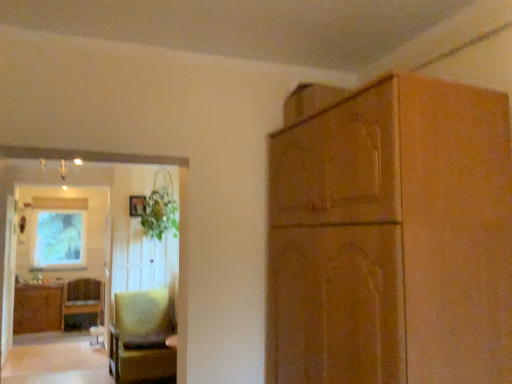
At what (x,y) coordinates should I click in order to perform the action: click on matte green painting at upper left. Please return your answer as a coordinate pair (x, y). Looking at the image, I should click on (58, 233).

Where is `velvet yellow chair at lower left, marked as the second chair in a left-to-right arrangement`? velvet yellow chair at lower left, marked as the second chair in a left-to-right arrangement is located at coordinates (142, 338).

Describe the element at coordinates (392, 239) in the screenshot. The width and height of the screenshot is (512, 384). I see `wooden cabinet at upper right, acting as the first cabinetry starting from the front` at that location.

This screenshot has height=384, width=512. I want to click on wooden chair at lower left, placed as the second chair when sorted from front to back, so click(83, 298).

Is wooden cabinet at upper right, placed as the second cabinetry when sorted from back to front, beside wooden chair at lower left, the first chair when ordered from left to right?

No, wooden cabinet at upper right, placed as the second cabinetry when sorted from back to front, is not with wooden chair at lower left, the first chair when ordered from left to right.

Is wooden cabinet at upper right, positioned as the 1th cabinetry in right-to-left order, to the right of wooden chair at lower left, placed as the second chair when sorted from front to back, from the viewer's perspective?

Correct, you'll find wooden cabinet at upper right, positioned as the 1th cabinetry in right-to-left order, to the right of wooden chair at lower left, placed as the second chair when sorted from front to back.

Between wooden cabinet at upper right, positioned as the 1th cabinetry in right-to-left order, and wooden chair at lower left, placed as the first chair when sorted from back to front, which one has less height?

wooden chair at lower left, placed as the first chair when sorted from back to front, is shorter.

What's the angular difference between green leafy plant at upper left and matte green painting at upper left's facing directions?

The angle between the facing direction of green leafy plant at upper left and the facing direction of matte green painting at upper left is 0.799 degrees.

Find the location of a particular element. The width and height of the screenshot is (512, 384). plant located in front of the matte green painting at upper left is located at coordinates (161, 208).

Based on the photo, is green leafy plant at upper left far away from matte green painting at upper left?

Yes, green leafy plant at upper left is far from matte green painting at upper left.

Is green leafy plant at upper left facing away from matte green painting at upper left?

No, green leafy plant at upper left's orientation is not away from matte green painting at upper left.

I want to click on plant lying behind the velvet yellow chair at lower left, which is the 1th chair from right to left, so click(x=161, y=208).

Which is behind, point (169, 325) or point (154, 217)?

The point (154, 217) is farther.

From a real-world perspective, which object stands above the other?

From a 3D spatial view, green leafy plant at upper left is above.

Between velvet yellow chair at lower left, which appears as the second chair when viewed from the back, and green leafy plant at upper left, which one has smaller size?

With smaller size is green leafy plant at upper left.

Considering the sizes of objects woven wicker cabinet at lower left, the 1th cabinetry from the left, and wooden cabinet at upper right, acting as the first cabinetry starting from the front, in the image provided, who is bigger, woven wicker cabinet at lower left, the 1th cabinetry from the left, or wooden cabinet at upper right, acting as the first cabinetry starting from the front,?

Bigger between the two is wooden cabinet at upper right, acting as the first cabinetry starting from the front.

From a real-world perspective, which object stands above the other?

wooden cabinet at upper right, which is the 2th cabinetry in bottom-to-top order, from a real-world perspective.

Considering the positions of points (57, 293) and (486, 308), is point (57, 293) closer to camera compared to point (486, 308)?

No, (57, 293) is behind (486, 308).

Between woven wicker cabinet at lower left, arranged as the first cabinetry when ordered from the bottom, and wooden cabinet at upper right, which is the 2th cabinetry in bottom-to-top order, which one has larger width?

With larger width is wooden cabinet at upper right, which is the 2th cabinetry in bottom-to-top order.

Is wooden chair at lower left, the second chair viewed from the right, at the back of velvet yellow chair at lower left, which is the 1th chair from right to left?

Correct, velvet yellow chair at lower left, which is the 1th chair from right to left, is looking away from wooden chair at lower left, the second chair viewed from the right.

Considering the relative sizes of velvet yellow chair at lower left, acting as the first chair starting from the front, and wooden chair at lower left, the second chair viewed from the right, in the image provided, is velvet yellow chair at lower left, acting as the first chair starting from the front, bigger than wooden chair at lower left, the second chair viewed from the right,?

Correct, velvet yellow chair at lower left, acting as the first chair starting from the front, is larger in size than wooden chair at lower left, the second chair viewed from the right.

From a real-world perspective, is velvet yellow chair at lower left, which appears as the second chair when viewed from the back, located beneath wooden chair at lower left, placed as the first chair when sorted from back to front?

Actually, velvet yellow chair at lower left, which appears as the second chair when viewed from the back, is physically above wooden chair at lower left, placed as the first chair when sorted from back to front, in the real world.

From a real-world perspective, which object stands above the other?

green leafy plant at upper left is physically above.

Is green leafy plant at upper left oriented away from wooden cabinet at upper right, positioned as the 1th cabinetry in right-to-left order?

No, wooden cabinet at upper right, positioned as the 1th cabinetry in right-to-left order, is not at the back of green leafy plant at upper left.

Is green leafy plant at upper left shorter than wooden cabinet at upper right, which is the first cabinetry in top-to-bottom order?

Yes, green leafy plant at upper left is shorter than wooden cabinet at upper right, which is the first cabinetry in top-to-bottom order.

Can you confirm if green leafy plant at upper left is smaller than wooden cabinet at upper right, which is the first cabinetry in top-to-bottom order?

Indeed, green leafy plant at upper left has a smaller size compared to wooden cabinet at upper right, which is the first cabinetry in top-to-bottom order.

From the image's perspective, is velvet yellow chair at lower left, which appears as the second chair when viewed from the back, below woven wicker cabinet at lower left, arranged as the first cabinetry when ordered from the bottom?

Actually, velvet yellow chair at lower left, which appears as the second chair when viewed from the back, appears above woven wicker cabinet at lower left, arranged as the first cabinetry when ordered from the bottom, in the image.

Is woven wicker cabinet at lower left, which appears as the 1th cabinetry when viewed from the back, a part of velvet yellow chair at lower left, marked as the second chair in a left-to-right arrangement?

Definitely not — woven wicker cabinet at lower left, which appears as the 1th cabinetry when viewed from the back, is not inside velvet yellow chair at lower left, marked as the second chair in a left-to-right arrangement.

Considering the relative positions of velvet yellow chair at lower left, acting as the first chair starting from the front, and woven wicker cabinet at lower left, which is the 2th cabinetry from right to left, in the image provided, is velvet yellow chair at lower left, acting as the first chair starting from the front, to the left or to the right of woven wicker cabinet at lower left, which is the 2th cabinetry from right to left,?

In the image, velvet yellow chair at lower left, acting as the first chair starting from the front, appears on the right side of woven wicker cabinet at lower left, which is the 2th cabinetry from right to left.

Which object is further away from the camera, velvet yellow chair at lower left, marked as the second chair in a left-to-right arrangement, or woven wicker cabinet at lower left, the 2th cabinetry positioned from the front?

woven wicker cabinet at lower left, the 2th cabinetry positioned from the front, is more distant.

You are a GUI agent. You are given a task and a screenshot of the screen. Output one action in this format:
    pyautogui.click(x=<x>, y=<y>)
    Task: Click on the 2nd chair behind the wooden cabinet at upper right, placed as the second cabinetry when sorted from back to front, starting your count from the anchor
    The width and height of the screenshot is (512, 384).
    Given the screenshot: What is the action you would take?
    pyautogui.click(x=83, y=298)

This screenshot has height=384, width=512. I want to click on plant above the matte green painting at upper left (from the image's perspective), so click(x=161, y=208).

Which object lies nearer to the anchor point matte green painting at upper left, wooden cabinet at upper right, acting as the first cabinetry starting from the front, or green leafy plant at upper left?

The object closer to matte green painting at upper left is green leafy plant at upper left.

Looking at this image, based on their spatial positions, is wooden chair at lower left, the first chair when ordered from left to right, or wooden cabinet at upper right, acting as the first cabinetry starting from the front, further from velvet yellow chair at lower left, which is the 1th chair from right to left?

Among the two, wooden cabinet at upper right, acting as the first cabinetry starting from the front, is located further to velvet yellow chair at lower left, which is the 1th chair from right to left.

Based on their spatial positions, is green leafy plant at upper left or woven wicker cabinet at lower left, arranged as the first cabinetry when ordered from the bottom, further from wooden cabinet at upper right, which is the second cabinetry from left to right?

woven wicker cabinet at lower left, arranged as the first cabinetry when ordered from the bottom, is further to wooden cabinet at upper right, which is the second cabinetry from left to right.

Considering their positions, is wooden cabinet at upper right, placed as the second cabinetry when sorted from back to front, positioned closer to green leafy plant at upper left than matte green painting at upper left?

matte green painting at upper left.

Looking at the image, which one is located closer to velvet yellow chair at lower left, marked as the second chair in a left-to-right arrangement, green leafy plant at upper left or woven wicker cabinet at lower left, placed as the second cabinetry when sorted from top to bottom?

green leafy plant at upper left is positioned closer to the anchor velvet yellow chair at lower left, marked as the second chair in a left-to-right arrangement.

Looking at the image, which one is located closer to woven wicker cabinet at lower left, which appears as the 1th cabinetry when viewed from the back, wooden cabinet at upper right, placed as the second cabinetry when sorted from back to front, or green leafy plant at upper left?

The object closer to woven wicker cabinet at lower left, which appears as the 1th cabinetry when viewed from the back, is green leafy plant at upper left.

Estimate the real-world distances between objects in this image. Which object is closer to velvet yellow chair at lower left, marked as the second chair in a left-to-right arrangement, matte green painting at upper left or woven wicker cabinet at lower left, which appears as the 1th cabinetry when viewed from the back?

woven wicker cabinet at lower left, which appears as the 1th cabinetry when viewed from the back.

Based on their spatial positions, is green leafy plant at upper left or wooden chair at lower left, the first chair when ordered from left to right, closer to woven wicker cabinet at lower left, the 1th cabinetry from the left?

wooden chair at lower left, the first chair when ordered from left to right.

The image size is (512, 384). I want to click on plant between wooden cabinet at upper right, which is the 2th cabinetry in bottom-to-top order, and woven wicker cabinet at lower left, placed as the second cabinetry when sorted from top to bottom, along the z-axis, so click(161, 208).

Locate an element on the screen. chair between green leafy plant at upper left and matte green painting at upper left from front to back is located at coordinates (83, 298).

This screenshot has width=512, height=384. In order to click on chair positioned between velvet yellow chair at lower left, marked as the second chair in a left-to-right arrangement, and matte green painting at upper left from near to far in this screenshot , I will do `click(83, 298)`.

Where is `window located between woven wicker cabinet at lower left, arranged as the first cabinetry when ordered from the bottom, and green leafy plant at upper left in the left-right direction`? Image resolution: width=512 pixels, height=384 pixels. window located between woven wicker cabinet at lower left, arranged as the first cabinetry when ordered from the bottom, and green leafy plant at upper left in the left-right direction is located at coordinates (58, 233).